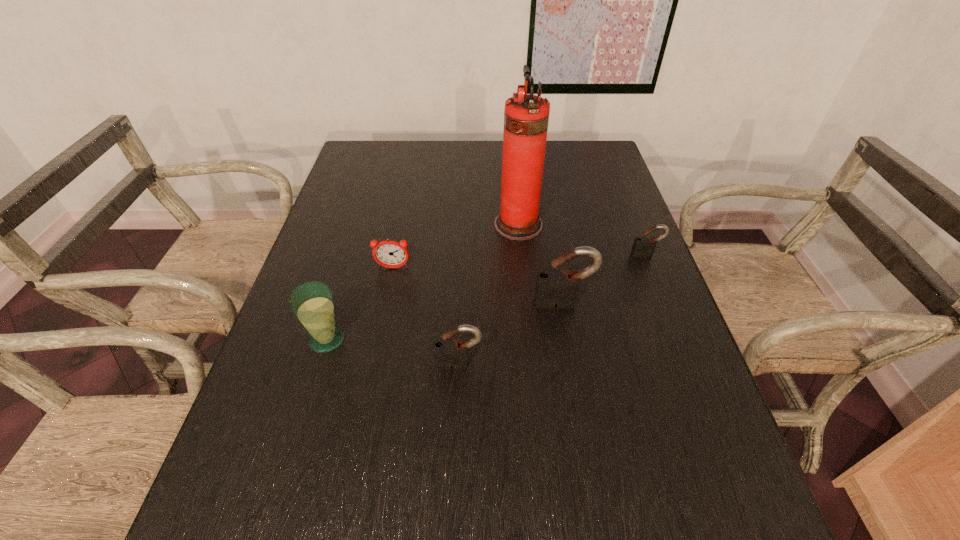
Where is `free space between the second farthest padlock and the leftmost object`? free space between the second farthest padlock and the leftmost object is located at coordinates (445, 321).

I want to click on free space between the glass and the third farthest object, so click(360, 304).

You are a GUI agent. You are given a task and a screenshot of the screen. Output one action in this format:
    pyautogui.click(x=<x>, y=<y>)
    Task: Click on the vacant region between the leftmost object and the second tallest object
    Image resolution: width=960 pixels, height=540 pixels.
    Given the screenshot: What is the action you would take?
    pyautogui.click(x=445, y=321)

Locate an element on the screen. empty space that is in between the fourth farthest object and the rightmost object is located at coordinates (605, 279).

Where is `free space between the second object from left to right and the shortest padlock`? Image resolution: width=960 pixels, height=540 pixels. free space between the second object from left to right and the shortest padlock is located at coordinates (519, 261).

Identify the location of vacant area that lies between the alarm clock and the fourth farthest object. This screenshot has width=960, height=540. (478, 286).

Where is `vacant region between the fire extinguisher and the second nearest object`? Image resolution: width=960 pixels, height=540 pixels. vacant region between the fire extinguisher and the second nearest object is located at coordinates (422, 282).

Point out which object is positioned as the fifth nearest to the glass. Please provide its 2D coordinates. Your answer should be formatted as a tuple, i.e. [(x, y)], where the tuple contains the x and y coordinates of a point satisfying the conditions above.

[(642, 245)]

The width and height of the screenshot is (960, 540). Identify the location of the third closest object to the third shortest object. (391, 254).

Select which padlock is the third closest to the tallest object. Please provide its 2D coordinates. Your answer should be formatted as a tuple, i.e. [(x, y)], where the tuple contains the x and y coordinates of a point satisfying the conditions above.

[(449, 353)]